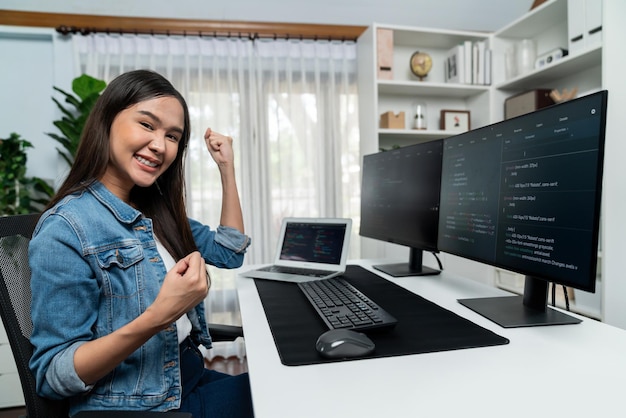
This screenshot has width=626, height=418. I want to click on chair, so click(12, 306).